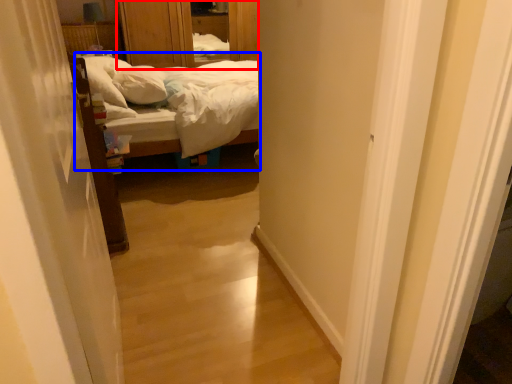
Question: Which of the following is the farthest to the observer, dresser (highlighted by a red box) or bed (highlighted by a blue box)?

Choices:
 (A) dresser
 (B) bed

Answer: (A)